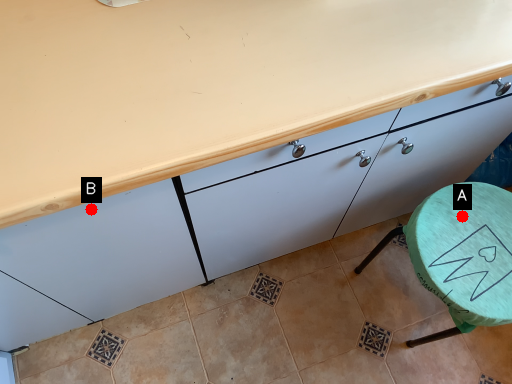
Question: Two points are circled on the image, labeled by A and B beside each circle. Among these points, which one is nearest to the camera?

Choices:
 (A) A is closer
 (B) B is closer

Answer: (B)